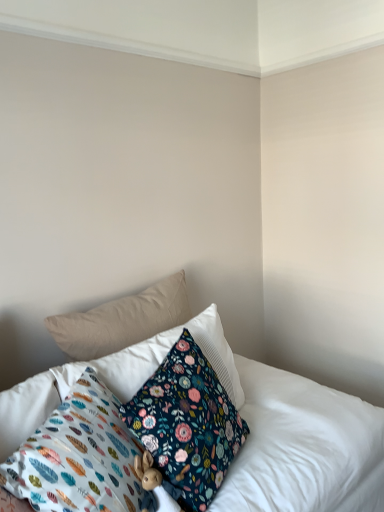
Question: From a real-world perspective, is floral fabric pillow at center, arranged as the second pillow when viewed from the front, positioned under beige fabric pillow at upper left, positioned as the 4th pillow in front-to-back order, based on gravity?

Choices:
 (A) yes
 (B) no

Answer: (A)

Question: Is floral fabric pillow at center, arranged as the second pillow when viewed from the front, oriented towards beige fabric pillow at upper left, positioned as the 4th pillow in front-to-back order?

Choices:
 (A) yes
 (B) no

Answer: (B)

Question: Is the depth of floral fabric pillow at center, acting as the 3th pillow starting from the back, less than that of beige fabric pillow at upper left, positioned as the 4th pillow in front-to-back order?

Choices:
 (A) no
 (B) yes

Answer: (B)

Question: Considering the relative sizes of floral fabric pillow at center, arranged as the second pillow when viewed from the front, and beige fabric pillow at upper left, positioned as the 4th pillow in front-to-back order, in the image provided, is floral fabric pillow at center, arranged as the second pillow when viewed from the front, wider than beige fabric pillow at upper left, positioned as the 4th pillow in front-to-back order,?

Choices:
 (A) no
 (B) yes

Answer: (B)

Question: Is floral fabric pillow at center, acting as the 3th pillow starting from the back, shorter than beige fabric pillow at upper left, the first pillow when ordered from back to front?

Choices:
 (A) no
 (B) yes

Answer: (A)

Question: Would you say floral fabric pillow at center, acting as the 3th pillow starting from the back, is to the left or to the right of beige fabric pillow at upper left, positioned as the 4th pillow in front-to-back order, in the picture?

Choices:
 (A) right
 (B) left

Answer: (A)

Question: Considering the positions of floral fabric pillow at center, arranged as the second pillow when viewed from the front, and beige fabric pillow at upper left, the first pillow when ordered from back to front, in the image, is floral fabric pillow at center, arranged as the second pillow when viewed from the front, taller or shorter than beige fabric pillow at upper left, the first pillow when ordered from back to front,?

Choices:
 (A) tall
 (B) short

Answer: (A)

Question: Is point (233, 441) positioned closer to the camera than point (84, 343)?

Choices:
 (A) farther
 (B) closer

Answer: (B)

Question: Is floral fabric pillow at center, arranged as the second pillow when viewed from the front, inside or outside of beige fabric pillow at upper left, positioned as the 4th pillow in front-to-back order?

Choices:
 (A) outside
 (B) inside

Answer: (A)

Question: Is floral fabric pillow at center, acting as the 3th pillow starting from the back, taller or shorter than floral fabric pillow at center, acting as the 3th pillow starting from the front?

Choices:
 (A) short
 (B) tall

Answer: (B)

Question: From the image's perspective, relative to floral fabric pillow at center, acting as the 3th pillow starting from the front, is floral fabric pillow at center, arranged as the second pillow when viewed from the front, above or below?

Choices:
 (A) below
 (B) above

Answer: (A)

Question: From a real-world perspective, is floral fabric pillow at center, arranged as the second pillow when viewed from the front, physically located above or below floral fabric pillow at center, marked as the 2th pillow in a back-to-front arrangement?

Choices:
 (A) above
 (B) below

Answer: (B)

Question: Is floral fabric pillow at center, acting as the 3th pillow starting from the back, in front of or behind floral fabric pillow at center, acting as the 3th pillow starting from the front, in the image?

Choices:
 (A) front
 (B) behind

Answer: (A)

Question: Is floral fabric pillow at center, marked as the 2th pillow in a back-to-front arrangement, situated inside floral fabric pillow at lower center, which is the 4th pillow in back-to-front order, or outside?

Choices:
 (A) inside
 (B) outside

Answer: (B)

Question: Is floral fabric pillow at center, marked as the 2th pillow in a back-to-front arrangement, in front of or behind floral fabric pillow at lower center, which is the 4th pillow in back-to-front order, in the image?

Choices:
 (A) behind
 (B) front

Answer: (A)